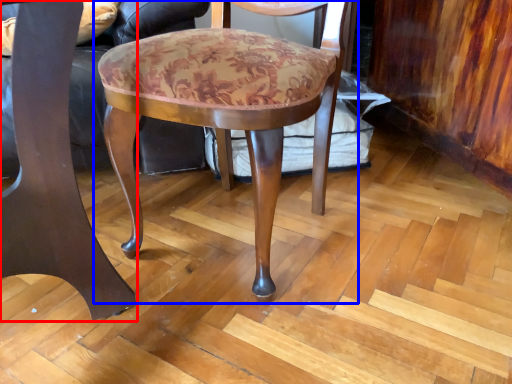
Question: Which object is closer to the camera taking this photo, chair (highlighted by a red box) or chair (highlighted by a blue box)?

Choices:
 (A) chair
 (B) chair

Answer: (A)